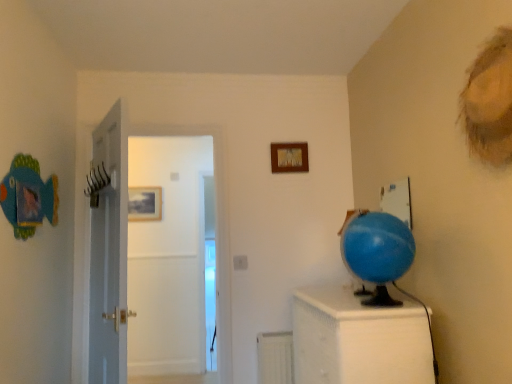
The image size is (512, 384). In order to click on vacant point above white glossy door at center (from a real-world perspective) in this screenshot , I will do `click(161, 113)`.